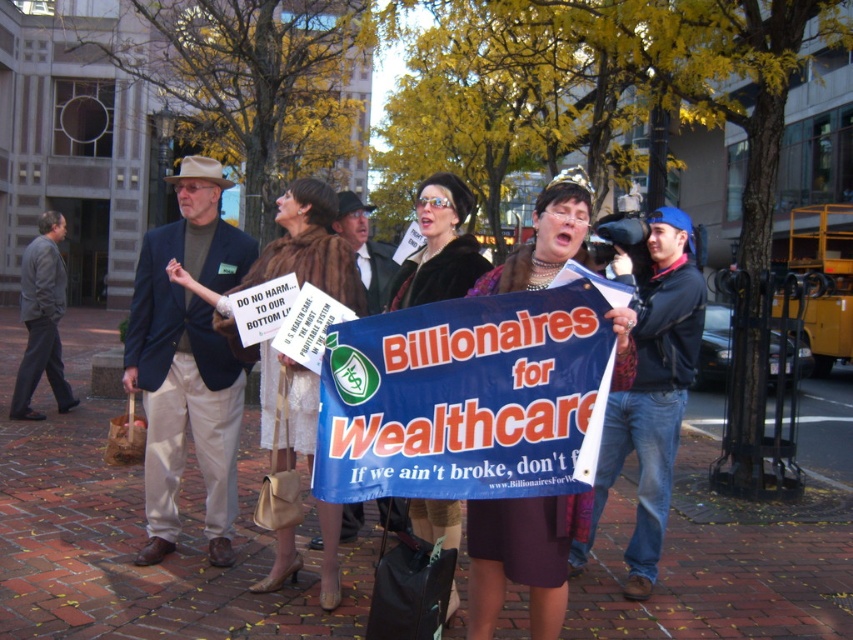
You are a delivery person trying to navigate through the protest area. You need to move your cart from the edge of the brick pavement at center to the brown fur coat at center. Is there enough space for your cart to pass between them?

The brick pavement at center is wider than the brown fur coat at center, so there is enough space for the cart to pass between them.

You are a photographer trying to capture a wide shot of the protest scene. You need to ensure that both the brick pavement at center and the velvet brown coat at center are clearly visible in your frame. Given the spatial relationship between them, which object should you prioritize framing closer to the center of your photo to accommodate their sizes?

The brick pavement at center should be prioritized closer to the center of the photo because its width is larger than the velvet brown coat at center, ensuring it is adequately captured in the frame.